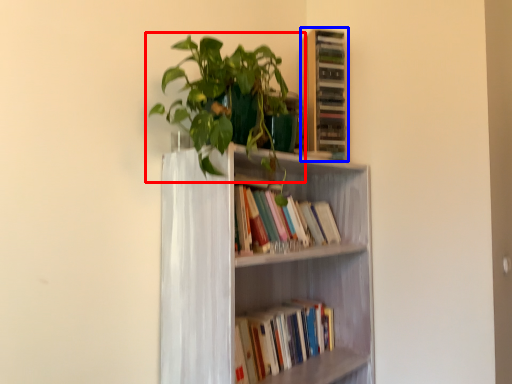
Question: Which object appears closest to the camera in this image, houseplant (highlighted by a red box) or shelf (highlighted by a blue box)?

Choices:
 (A) houseplant
 (B) shelf

Answer: (A)